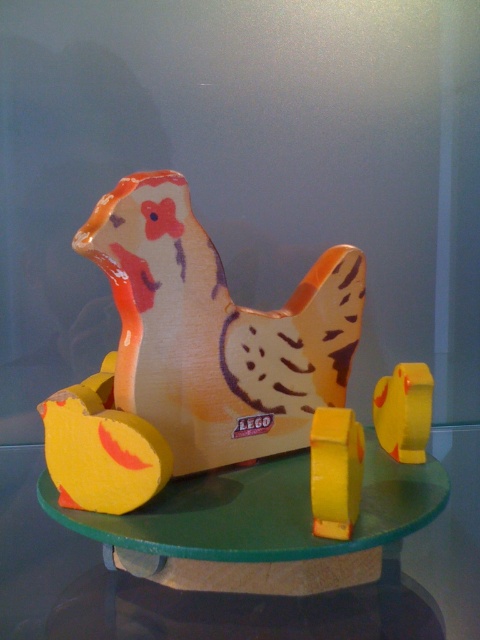
How much distance is there between wooden chicken at center and yellow matte/soft plastic at center?

wooden chicken at center and yellow matte/soft plastic at center are 9.36 inches apart from each other.

Can you confirm if wooden chicken at center is wider than yellow matte/soft plastic at center?

Correct, the width of wooden chicken at center exceeds that of yellow matte/soft plastic at center.

Describe the element at coordinates (205, 365) in the screenshot. The height and width of the screenshot is (640, 480). I see `wooden chicken at center` at that location.

Identify the location of wooden chicken at center. (205, 365).

Is green glass table at center positioned in front of yellow matte/soft plastic at center?

Yes.

Is point (452, 509) positioned in front of point (388, 381)?

No, it is not.

Who is more distant from viewer, (x=12, y=513) or (x=423, y=408)?

Point (x=12, y=513)

Where is `green glass table at center`? Image resolution: width=480 pixels, height=640 pixels. green glass table at center is located at coordinates point(453,534).

How distant is wooden chicken at center from green glass table at center?

wooden chicken at center is 42.41 centimeters away from green glass table at center.

Does point (322, 381) come in front of point (472, 525)?

No, (322, 381) is further to viewer.

Locate an element on the screen. This screenshot has height=640, width=480. wooden chicken at center is located at coordinates (205, 365).